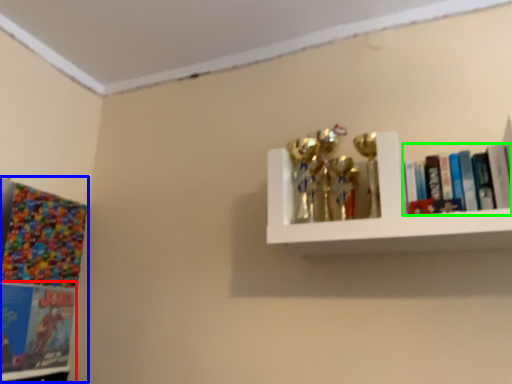
Question: Which is nearer to the book (highlighted by a red box)? comic book (highlighted by a blue box) or book (highlighted by a green box).

Choices:
 (A) comic book
 (B) book

Answer: (A)